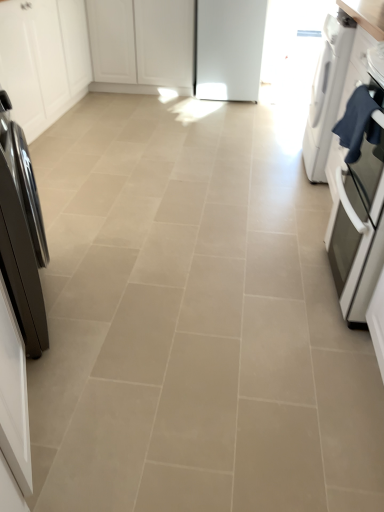
I want to click on vacant space behind matte stainless steel oven at right, so click(293, 231).